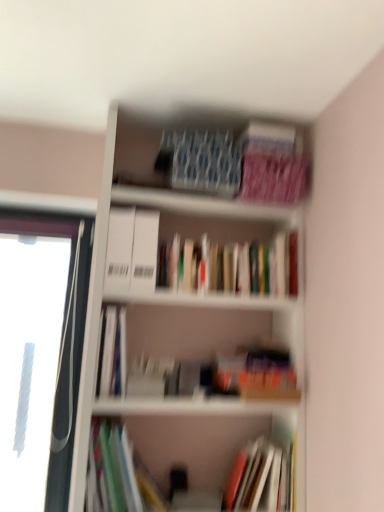
Question: Is hardcover books at center, which is the 1th book in top-to-bottom order, bigger or smaller than multicolored paper at lower left, which appears as the second book when ordered from the bottom?

Choices:
 (A) small
 (B) big

Answer: (B)

Question: Would you say hardcover books at center, which is the 1th book in top-to-bottom order, is to the left or to the right of multicolored paper at lower left, which appears as the second book when ordered from the bottom, in the picture?

Choices:
 (A) left
 (B) right

Answer: (B)

Question: Estimate the real-world distances between objects in this image. Which object is farther from the white matte bookcase at upper center?

Choices:
 (A) blue textured paper at upper center, acting as the second paperback book starting from the right
 (B) multicolored paper at lower left, which appears as the second book when ordered from the bottom
 (C) hardcover book at center, positioned as the fourth book in top-to-bottom order
 (D) white plastic window frame at left
 (E) hardcover books at center, which is the 1th book in top-to-bottom order

Answer: (C)

Question: Estimate the real-world distances between objects in this image. Which object is closer to the pink matte paperback book at upper right, arranged as the 2th paperback book when viewed from the left?

Choices:
 (A) hardcover books at center, which is the 1th book in top-to-bottom order
 (B) hardcover book at center, the 1th book positioned from the bottom
 (C) multicolored paper at lower left, which appears as the second book when ordered from the bottom
 (D) white plastic window frame at left
 (E) hardcover book at center, the 2th book when ordered from top to bottom

Answer: (A)